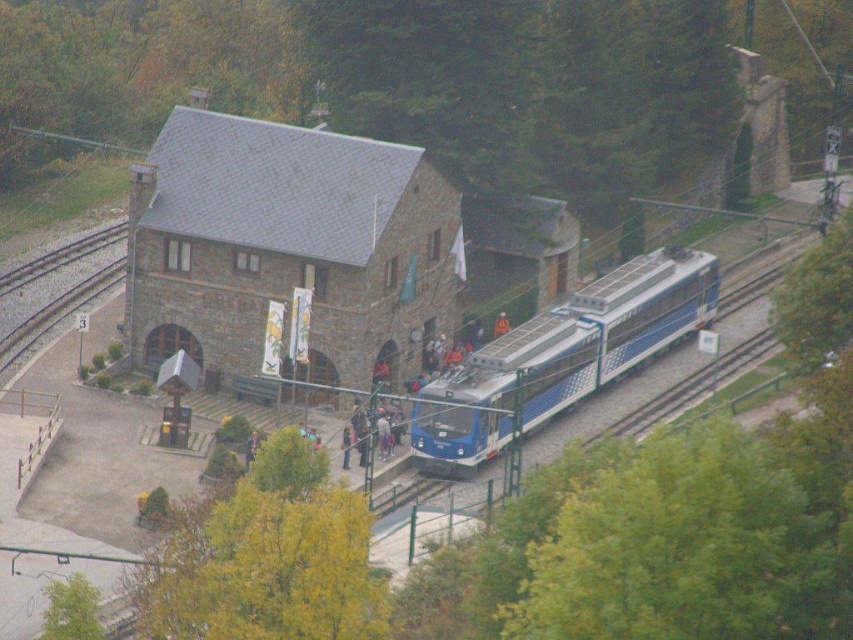
Who is more distant from viewer, (358, 227) or (810, 589)?

The point (358, 227) is more distant.

Is point (364, 218) closer to camera compared to point (614, 589)?

That is False.

Locate an element on the screen. stone textured building at center is located at coordinates (286, 248).

Does green leafy tree at upper center lie behind green leafy tree at right?

Yes, it is.

Which is below, green leafy tree at upper center or green leafy tree at right?

Positioned lower is green leafy tree at right.

Locate an element on the screen. green leafy tree at upper center is located at coordinates 135,68.

Where is `green leafy tree at upper center`? green leafy tree at upper center is located at coordinates (135, 68).

Does blue metallic train at center appear on the right side of orange fabric person at center?

Correct, you'll find blue metallic train at center to the right of orange fabric person at center.

Is blue metallic train at center further to the viewer compared to orange fabric person at center?

No, blue metallic train at center is closer to the viewer.

Locate an element on the screen. blue metallic train at center is located at coordinates (561, 355).

You are a GUI agent. You are given a task and a screenshot of the screen. Output one action in this format:
    pyautogui.click(x=<x>, y=<y>)
    Task: Click on the blue metallic train at center
    This screenshot has height=640, width=853.
    Given the screenshot: What is the action you would take?
    pyautogui.click(x=561, y=355)